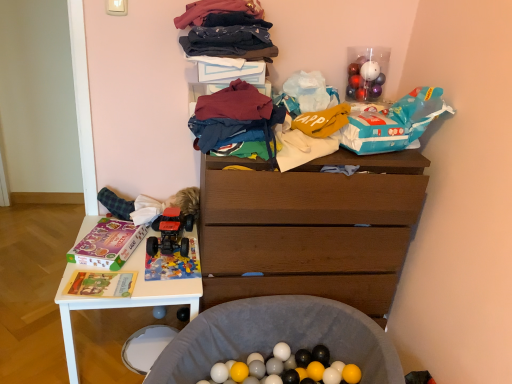
Identify the location of free point above matte yellow book at lower left, acting as the first magazine starting from the front (from a real-world perspective). The height and width of the screenshot is (384, 512). (101, 282).